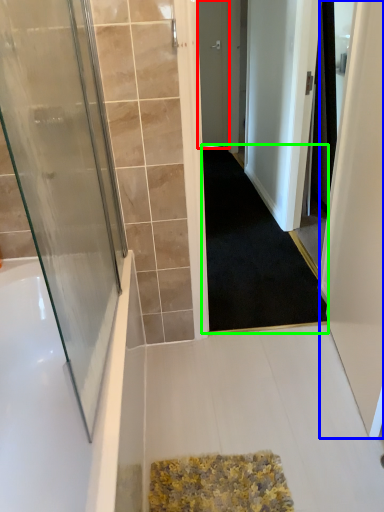
Question: Which object is positioned closest to door (highlighted by a red box)? Select from screen door (highlighted by a blue box) and doormat (highlighted by a green box).

Choices:
 (A) screen door
 (B) doormat

Answer: (B)